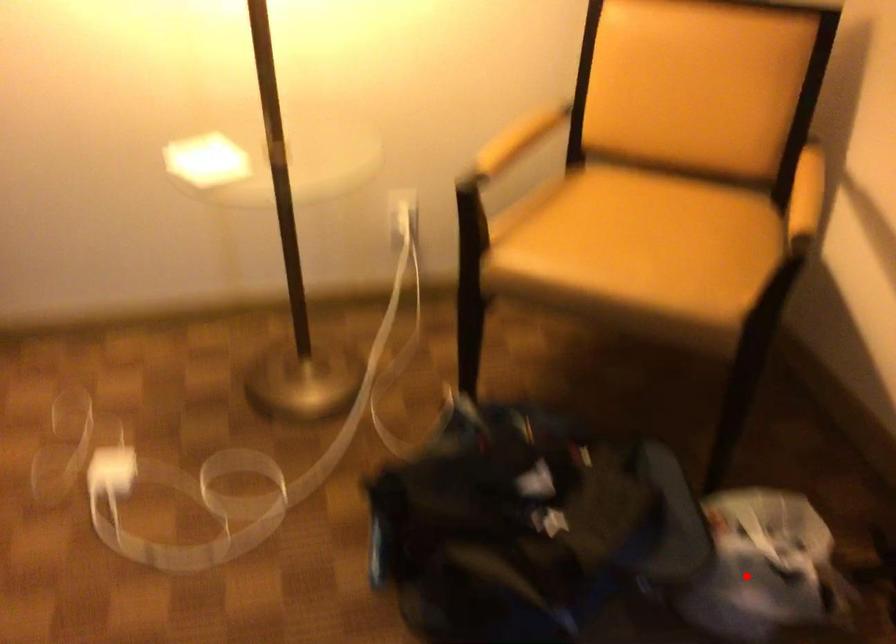
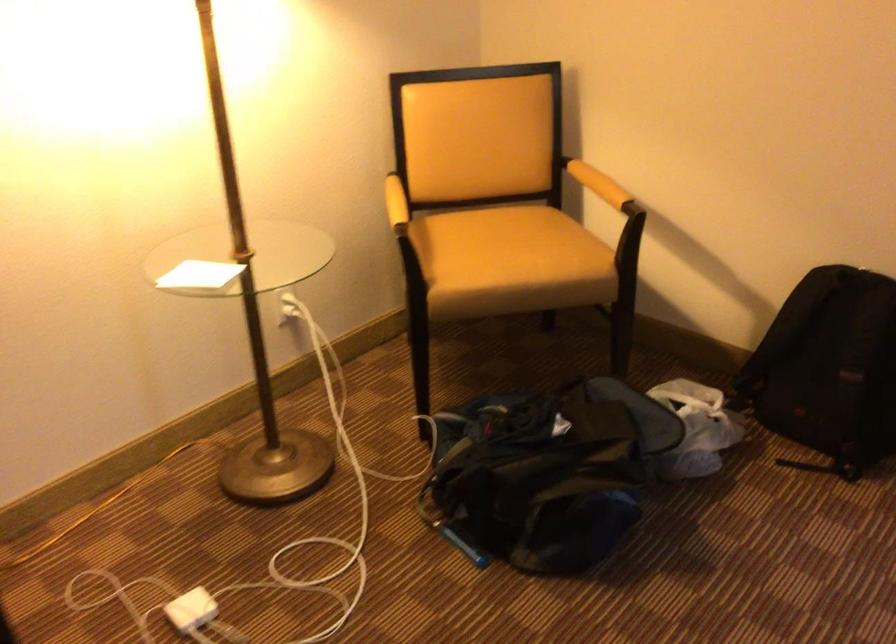
The point at the highlighted location is marked in the first image. Where is the corresponding point in the second image?

(696, 428)